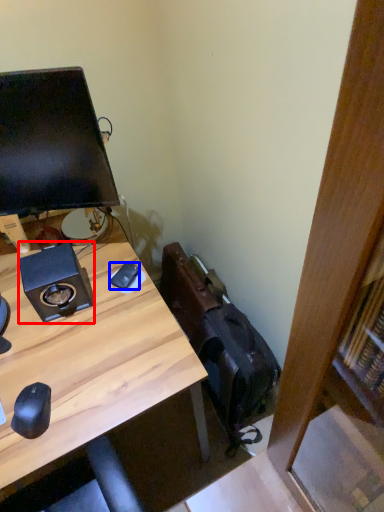
Question: Which object appears farthest to the camera in this image, speaker (highlighted by a red box) or mouse (highlighted by a blue box)?

Choices:
 (A) speaker
 (B) mouse

Answer: (B)